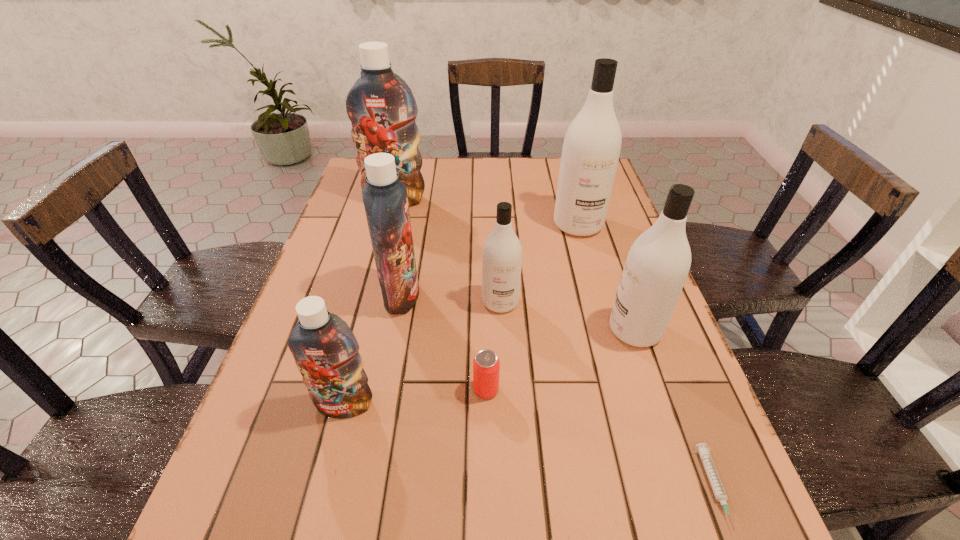
Locate an element on the screen. This screenshot has height=540, width=960. vacant region that satisfies the following two spatial constraints: 1. on the front-facing side of the second farthest shampoo; 2. on the front label of the second farthest blue shampoo is located at coordinates (598, 295).

Locate an element on the screen. The image size is (960, 540). free spot that satisfies the following two spatial constraints: 1. on the front label of the second farthest blue shampoo; 2. on the back side of the red beer can is located at coordinates (383, 390).